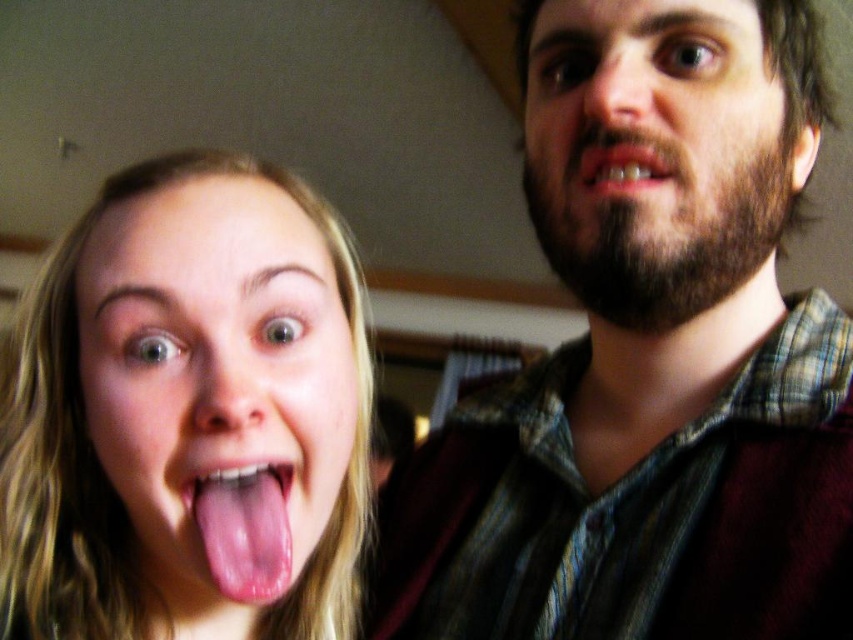
Which is above, beardhairman at right or pink flesh-colored tongue at lower left?

beardhairman at right

Is beardhairman at right smaller than pink flesh-colored tongue at lower left?

No, beardhairman at right is not smaller than pink flesh-colored tongue at lower left.

Is point (608, 291) farther from camera compared to point (244, 588)?

That is True.

At what (x,y) coordinates should I click in order to perform the action: click on beardhairman at right. Please return your answer as a coordinate pair (x, y). Image resolution: width=853 pixels, height=640 pixels. Looking at the image, I should click on (666, 150).

Looking at this image, who is lower down, pink flesh at center or beardhairman at right?

pink flesh at center is lower down.

Identify the location of pink flesh at center. (216, 385).

Who is more distant from viewer, (161, 520) or (602, 38)?

Positioned behind is point (602, 38).

Where is `pink flesh at center`? This screenshot has height=640, width=853. pink flesh at center is located at coordinates (216, 385).

Between pink flesh-colored tongue at lower left and pink glossy lips at upper center, which one is positioned lower?

pink flesh-colored tongue at lower left

Based on the photo, who is positioned more to the right, pink flesh-colored tongue at lower left or pink glossy lips at upper center?

pink glossy lips at upper center

Locate an element on the screen. This screenshot has height=640, width=853. pink flesh-colored tongue at lower left is located at coordinates (245, 531).